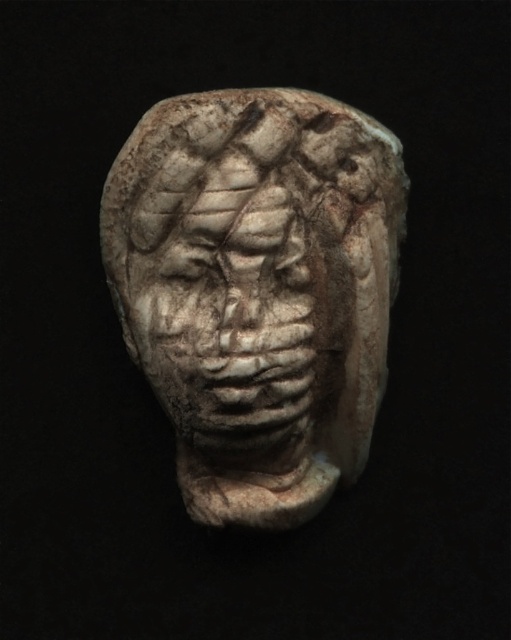
Is white stone head at center in front of gray stone face at center?

No, white stone head at center is behind gray stone face at center.

Is white stone head at center further to the viewer compared to gray stone face at center?

That is True.

Does point (138, 186) lie behind point (222, 312)?

Yes, point (138, 186) is farther from viewer.

The width and height of the screenshot is (511, 640). I want to click on white stone head at center, so click(258, 289).